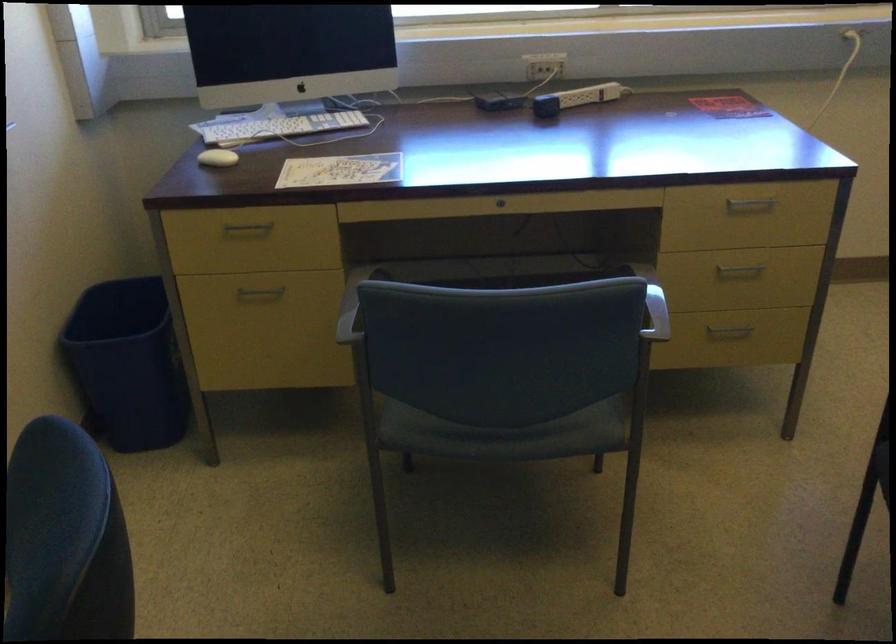
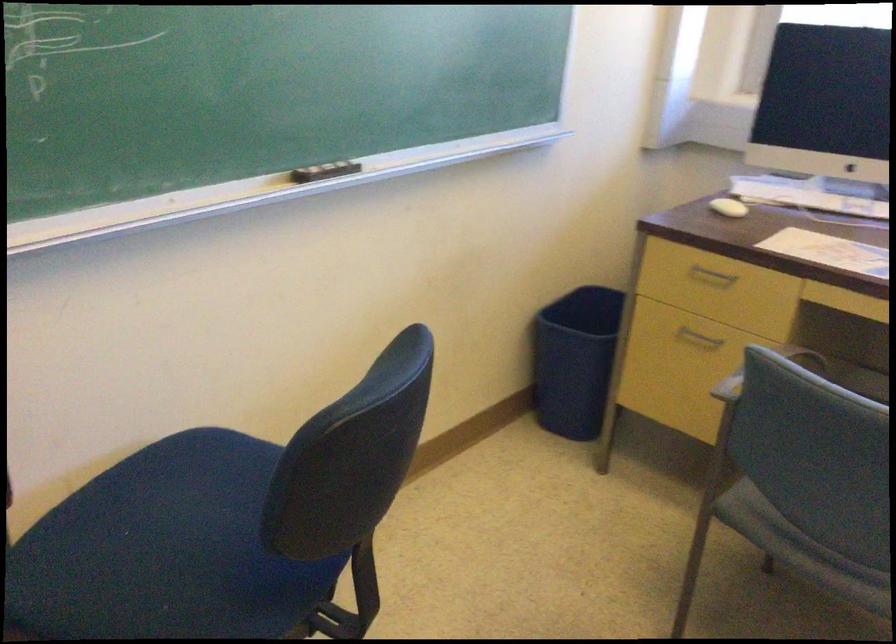
Find the pixel in the second image that matches (x=245, y=237) in the first image.

(711, 277)